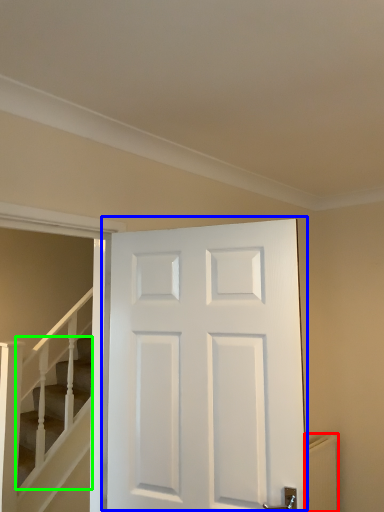
Question: Estimate the real-world distances between objects in this image. Which object is closer to radiator (highlighted by a red box), door (highlighted by a blue box) or stairs (highlighted by a green box)?

Choices:
 (A) door
 (B) stairs

Answer: (A)